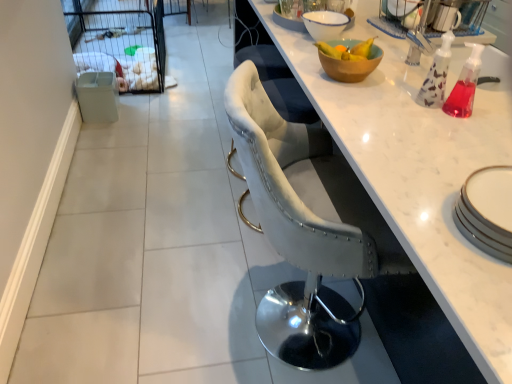
Question: Is velvet grey chair at center looking in the opposite direction of wooden bowl at upper right, the 1th bowl positioned from the bottom?

Choices:
 (A) yes
 (B) no

Answer: (B)

Question: Is velvet grey chair at center positioned behind wooden bowl at upper right, the 1th bowl positioned from the front?

Choices:
 (A) no
 (B) yes

Answer: (A)

Question: Considering the relative sizes of velvet grey chair at center and wooden bowl at upper right, the 1th bowl positioned from the front, in the image provided, is velvet grey chair at center bigger than wooden bowl at upper right, the 1th bowl positioned from the front,?

Choices:
 (A) yes
 (B) no

Answer: (A)

Question: Considering the relative positions of velvet grey chair at center and wooden bowl at upper right, the 1th bowl positioned from the bottom, in the image provided, is velvet grey chair at center to the right of wooden bowl at upper right, the 1th bowl positioned from the bottom, from the viewer's perspective?

Choices:
 (A) yes
 (B) no

Answer: (B)

Question: From a real-world perspective, is velvet grey chair at center below wooden bowl at upper right, the 2th bowl positioned from the back?

Choices:
 (A) yes
 (B) no

Answer: (A)

Question: From a real-world perspective, is velvet grey chair at center positioned above or below white ceramic bowl at upper center, the 2th bowl when ordered from front to back?

Choices:
 (A) below
 (B) above

Answer: (A)

Question: Considering the positions of velvet grey chair at center and white ceramic bowl at upper center, which is the 1th bowl in back-to-front order, in the image, is velvet grey chair at center wider or thinner than white ceramic bowl at upper center, which is the 1th bowl in back-to-front order,?

Choices:
 (A) thin
 (B) wide

Answer: (B)

Question: Would you say velvet grey chair at center is inside or outside white ceramic bowl at upper center, the 2th bowl when ordered from front to back?

Choices:
 (A) outside
 (B) inside

Answer: (A)

Question: From the image's perspective, is velvet grey chair at center located above or below white ceramic bowl at upper center, the 2th bowl when ordered from front to back?

Choices:
 (A) below
 (B) above

Answer: (A)

Question: Visually, is white marble countertop at center positioned to the left or to the right of white ceramic bowl at upper center, the 2th bowl when ordered from front to back?

Choices:
 (A) left
 (B) right

Answer: (A)

Question: Is white marble countertop at center in front of or behind white ceramic bowl at upper center, positioned as the 1th bowl in top-to-bottom order, in the image?

Choices:
 (A) front
 (B) behind

Answer: (A)

Question: Considering the positions of white marble countertop at center and white ceramic bowl at upper center, arranged as the 2th bowl when ordered from the bottom, in the image, is white marble countertop at center wider or thinner than white ceramic bowl at upper center, arranged as the 2th bowl when ordered from the bottom,?

Choices:
 (A) wide
 (B) thin

Answer: (A)

Question: Which is correct: white marble countertop at center is inside white ceramic bowl at upper center, which is the 1th bowl in back-to-front order, or outside of it?

Choices:
 (A) inside
 (B) outside

Answer: (B)

Question: From a real-world perspective, is velvet grey chair at center positioned above or below white mesh screen door at upper left?

Choices:
 (A) below
 (B) above

Answer: (B)

Question: Considering their positions, is velvet grey chair at center located in front of or behind white mesh screen door at upper left?

Choices:
 (A) behind
 (B) front

Answer: (B)